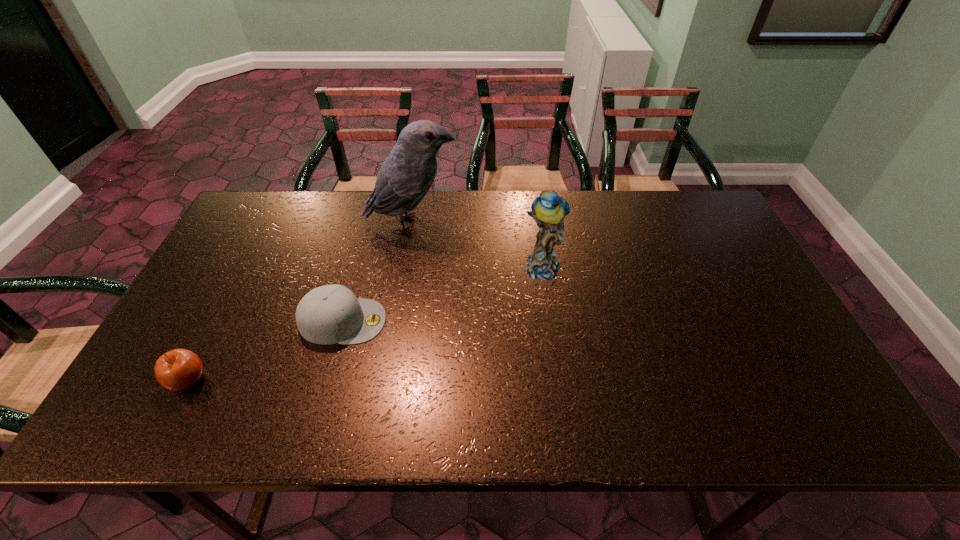
This screenshot has height=540, width=960. Identify the location of vacant space at the far left corner. (258, 204).

At what (x,y) coordinates should I click in order to perform the action: click on vacant space at the far right corner of the desktop. Please return your answer as a coordinate pair (x, y). The width and height of the screenshot is (960, 540). Looking at the image, I should click on click(x=696, y=199).

The image size is (960, 540). I want to click on vacant area between the second farthest object and the farthest object, so click(477, 246).

The width and height of the screenshot is (960, 540). Identify the location of free space between the rightmost object and the farthest object. (477, 246).

You are a GUI agent. You are given a task and a screenshot of the screen. Output one action in this format:
    pyautogui.click(x=<x>, y=<y>)
    Task: Click on the vacant space that is in between the nearer parrot and the second nearest object
    This screenshot has width=960, height=540.
    Given the screenshot: What is the action you would take?
    pyautogui.click(x=443, y=294)

Locate an element on the screen. The image size is (960, 540). vacant space that's between the second nearest object and the farthest object is located at coordinates (377, 273).

The image size is (960, 540). Identify the location of free space between the farther parrot and the second tallest object. (477, 246).

Image resolution: width=960 pixels, height=540 pixels. I want to click on free space between the left parrot and the third nearest object, so click(x=477, y=246).

Image resolution: width=960 pixels, height=540 pixels. I want to click on vacant space that's between the cap and the leftmost object, so click(266, 350).

Where is `vacant area that lies between the shortest object and the apple`? vacant area that lies between the shortest object and the apple is located at coordinates (266, 350).